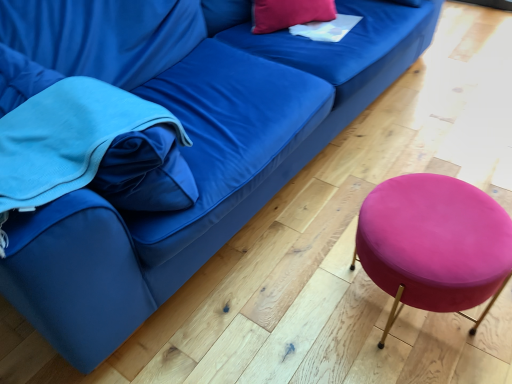
Where is `free point above velvet pink stool at lower right (from a real-world perspective)`? free point above velvet pink stool at lower right (from a real-world perspective) is located at coordinates [x=435, y=217].